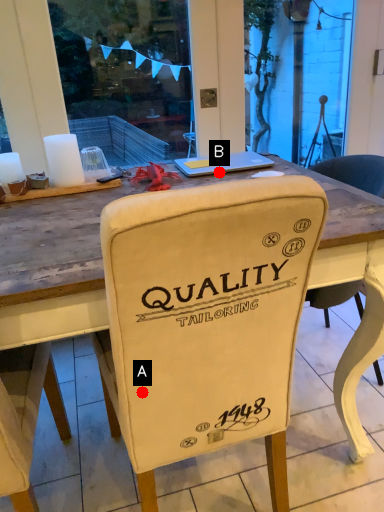
Question: Two points are circled on the image, labeled by A and B beside each circle. Among these points, which one is nearest to the camera?

Choices:
 (A) A is closer
 (B) B is closer

Answer: (A)